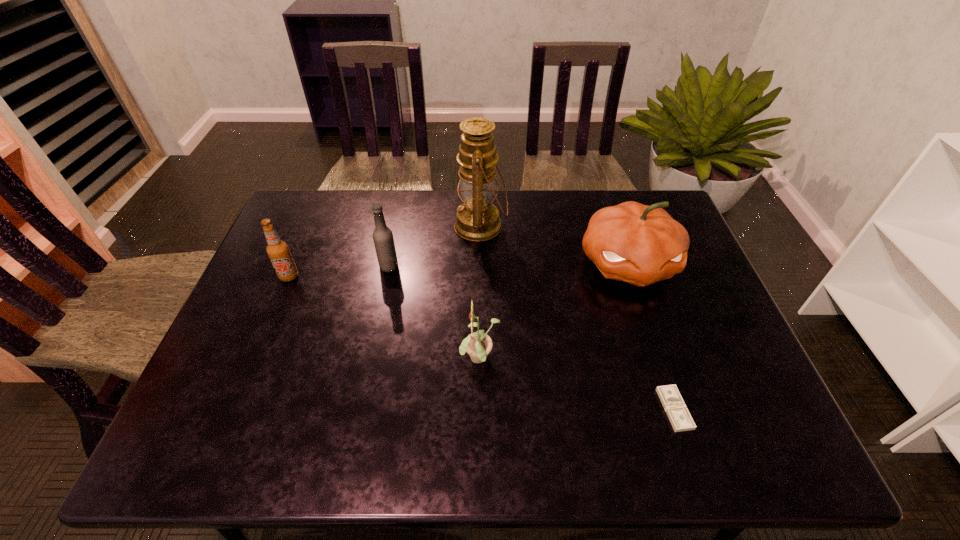
What are the coordinates of `oil lamp` in the screenshot? It's located at (477, 219).

Image resolution: width=960 pixels, height=540 pixels. I want to click on pumpkin, so click(x=638, y=244).

Image resolution: width=960 pixels, height=540 pixels. I want to click on the right beer bottle, so click(x=383, y=239).

Image resolution: width=960 pixels, height=540 pixels. I want to click on the leftmost object, so click(x=278, y=251).

The height and width of the screenshot is (540, 960). I want to click on the second nearest object, so click(478, 345).

In order to click on money in this screenshot , I will do click(x=677, y=412).

I want to click on the shortest object, so click(x=677, y=412).

Identify the location of blank area located on the left of the oil lamp. This screenshot has height=540, width=960. (432, 226).

Find the location of a particular element. blank space located on the front face of the pumpkin is located at coordinates (648, 322).

I want to click on vacant space situated on the label of the second object from left to right, so click(x=528, y=266).